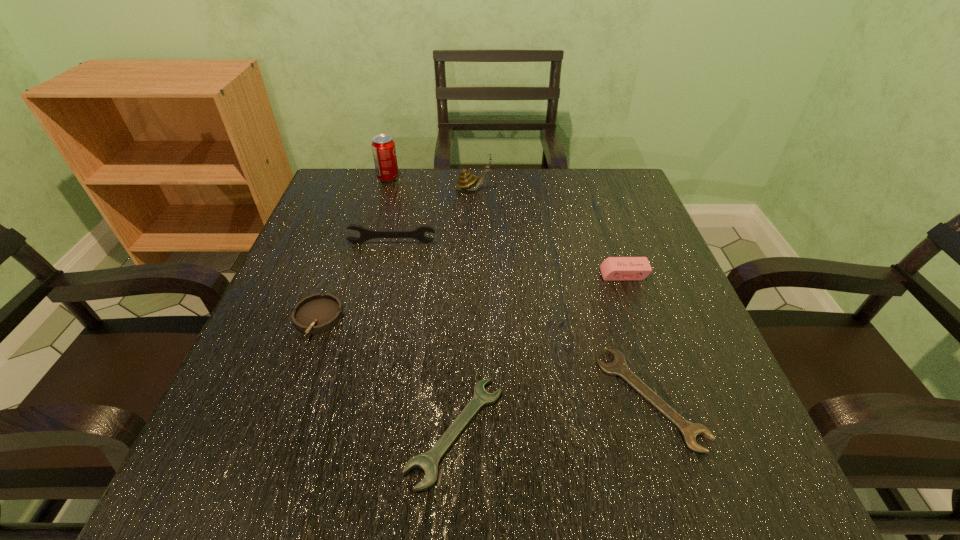
The height and width of the screenshot is (540, 960). Find the location of `object that is the second nearest to the second tallest object`. object that is the second nearest to the second tallest object is located at coordinates (365, 234).

Select which wrench appears as the second closest to the rightmost wrench. Please provide its 2D coordinates. Your answer should be formatted as a tuple, i.e. [(x, y)], where the tuple contains the x and y coordinates of a point satisfying the conditions above.

[(365, 234)]

Locate which wrench ranks in proximity to the fourth tallest object. Please provide its 2D coordinates. Your answer should be formatted as a tuple, i.e. [(x, y)], where the tuple contains the x and y coordinates of a point satisfying the conditions above.

[(618, 367)]

Where is `vacant space that satisfies the following two spatial constraints: 1. on the face of the second tallest object; 2. on the left side of the rightmost wrench`? This screenshot has height=540, width=960. vacant space that satisfies the following two spatial constraints: 1. on the face of the second tallest object; 2. on the left side of the rightmost wrench is located at coordinates (469, 397).

Find the location of `free spot that satisfies the following two spatial constraints: 1. on the face of the eraser; 2. on the right side of the snail`. free spot that satisfies the following two spatial constraints: 1. on the face of the eraser; 2. on the right side of the snail is located at coordinates (472, 274).